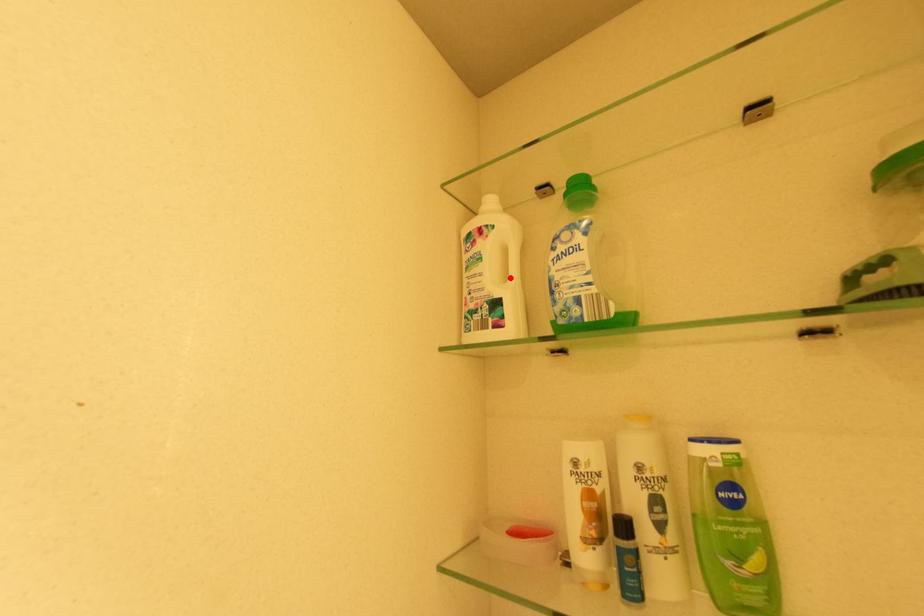
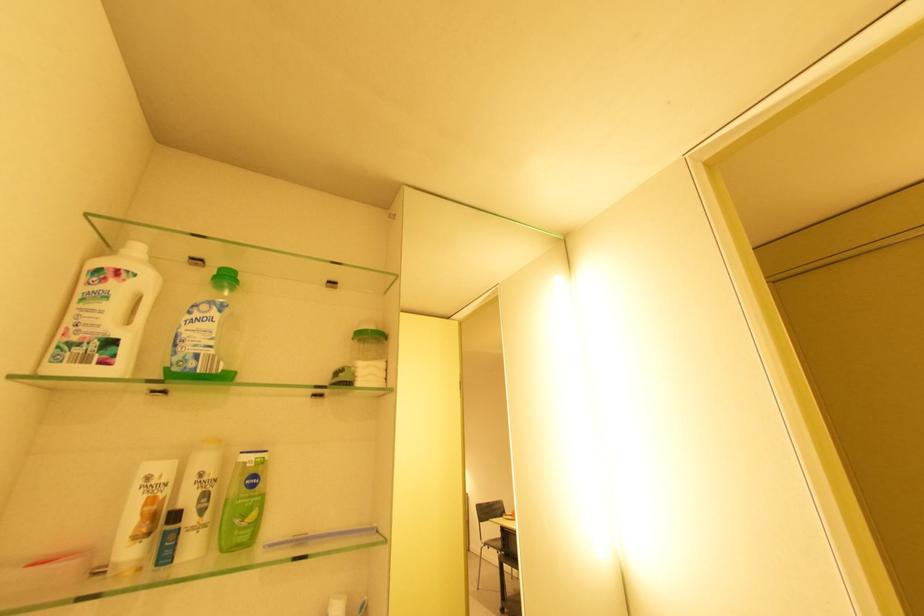
Where in the second image is the point corresponding to the highlighted location from the first image?

(134, 321)